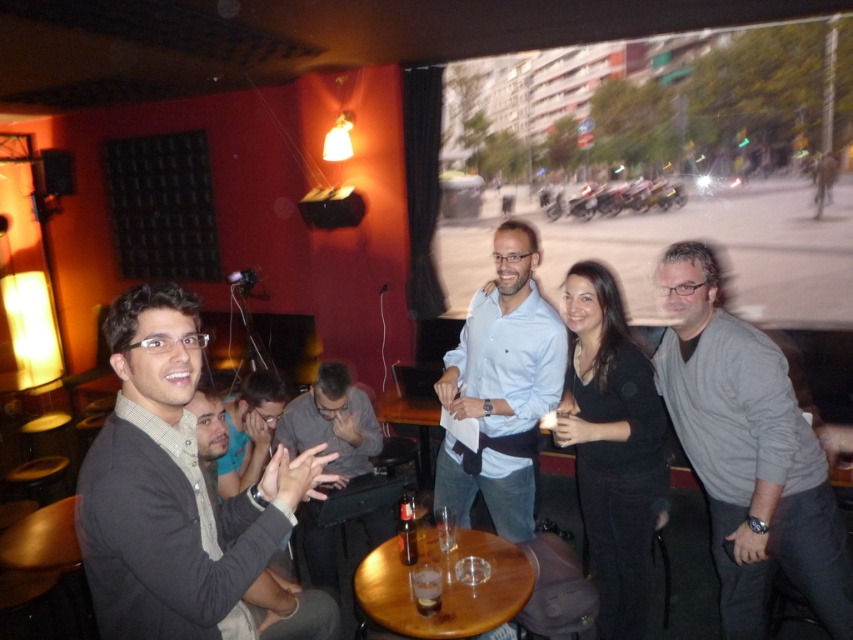
This screenshot has height=640, width=853. Describe the element at coordinates (747, 451) in the screenshot. I see `gray sweater at center` at that location.

This screenshot has height=640, width=853. Find the location of `gray sweater at center`. gray sweater at center is located at coordinates click(x=747, y=451).

Find the location of a particular element. The width and height of the screenshot is (853, 640). gray sweater at center is located at coordinates (747, 451).

Can you confirm if wooden table at center is positioned to the right of gray fabric shirt at center?

Yes, wooden table at center is to the right of gray fabric shirt at center.

From the picture: Who is more forward, (424, 634) or (299, 440)?

Positioned in front is point (424, 634).

You are a GUI agent. You are given a task and a screenshot of the screen. Output one action in this format:
    pyautogui.click(x=<x>, y=<y>)
    Task: Click on the wooden table at center
    The width and height of the screenshot is (853, 640).
    Given the screenshot: What is the action you would take?
    pyautogui.click(x=442, y=586)

Does light blue shirt at center have a larger size compared to gray fabric shirt at center?

Actually, light blue shirt at center might be smaller than gray fabric shirt at center.

Who is positioned more to the left, light blue shirt at center or gray fabric shirt at center?

Positioned to the left is gray fabric shirt at center.

Which is behind, point (497, 323) or point (312, 417)?

Positioned behind is point (312, 417).

The image size is (853, 640). Identify the location of light blue shirt at center. (502, 388).